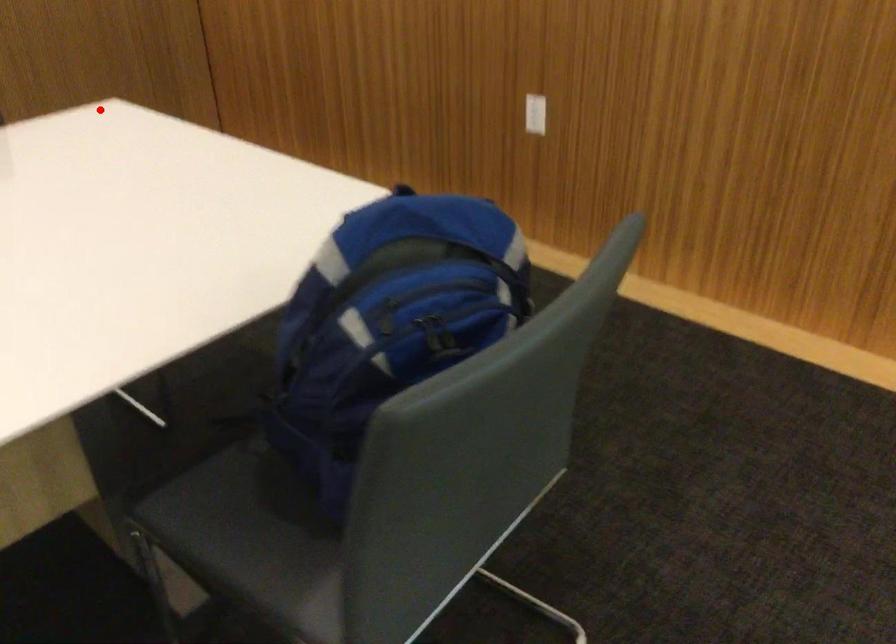
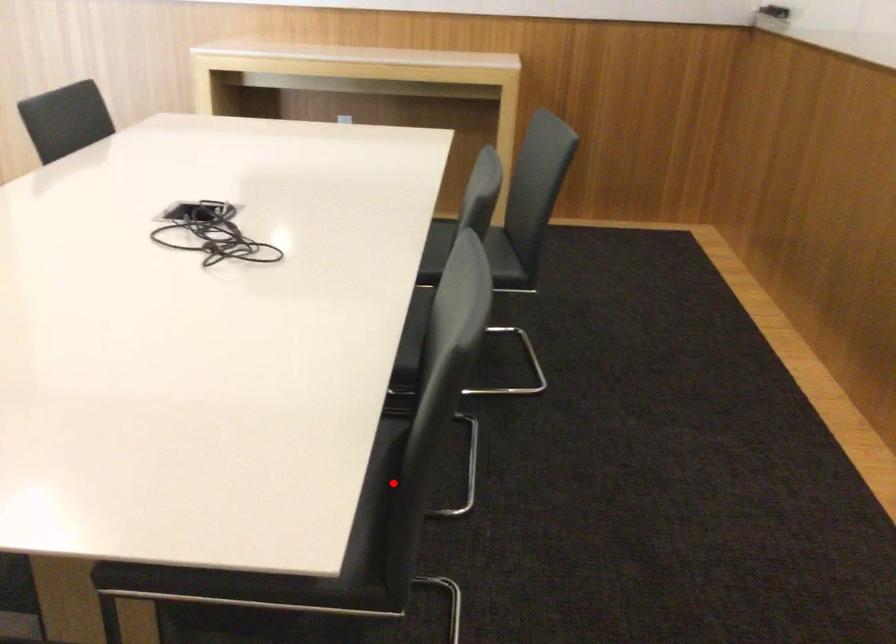
Based on the photo, I am providing you with two images of the same scene from different viewpoints. A red point is marked on the first image and another point is marked on the second image. Is the red point in image1 aligned with the point shown in image2?

No